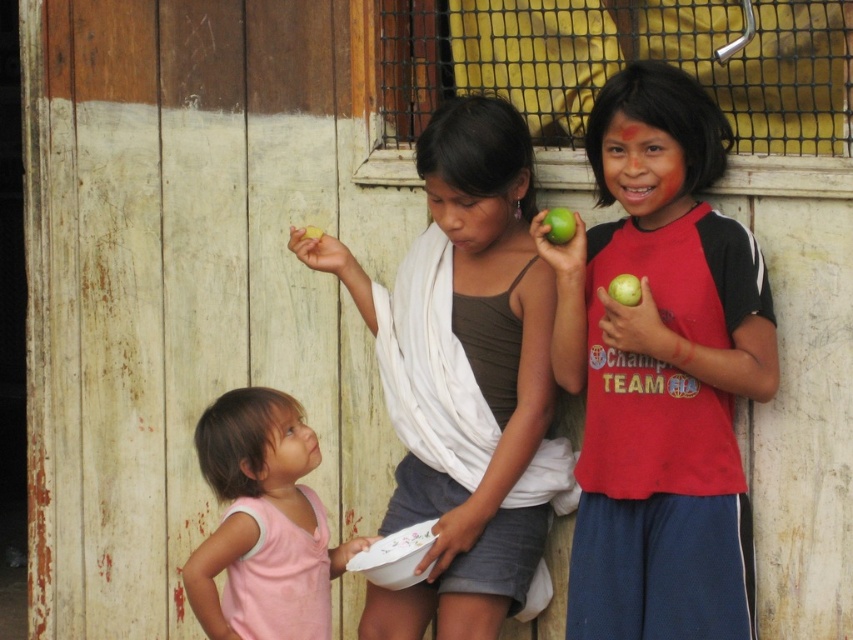
Question: Which object appears closest to the camera in this image?

Choices:
 (A) matte red shirt at center
 (B) pink fabric shirt at lower left
 (C) matte brown tank top at center

Answer: (A)

Question: Does pink fabric shirt at lower left have a smaller size compared to green matte apple at right?

Choices:
 (A) no
 (B) yes

Answer: (A)

Question: Among these objects, which one is nearest to the camera?

Choices:
 (A) green matte apple at right
 (B) green matte apple at upper right

Answer: (A)

Question: Can you confirm if pink fabric shirt at lower left is thinner than green matte apple at right?

Choices:
 (A) yes
 (B) no

Answer: (B)

Question: Does matte red shirt at center have a smaller size compared to green matte apple at upper right?

Choices:
 (A) yes
 (B) no

Answer: (B)

Question: Which object is closer to the camera taking this photo?

Choices:
 (A) pink fabric shirt at lower left
 (B) green matte apple at upper right
 (C) green matte apple at right
 (D) matte red shirt at center

Answer: (C)